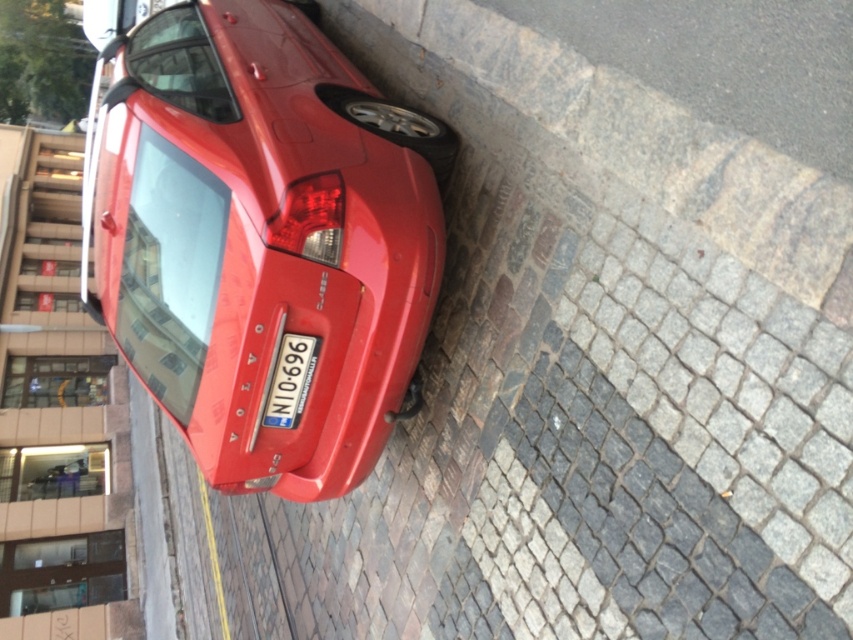
What do you see at coordinates (262, 237) in the screenshot? The width and height of the screenshot is (853, 640). I see `glossy red car at center` at bounding box center [262, 237].

Is glossy red car at center above blue metallic license plate at center?

Yes.

Consider the image. Measure the distance between point (323, 88) and camera.

Point (323, 88) is 12.96 feet from camera.

Identify the location of glossy red car at center. (262, 237).